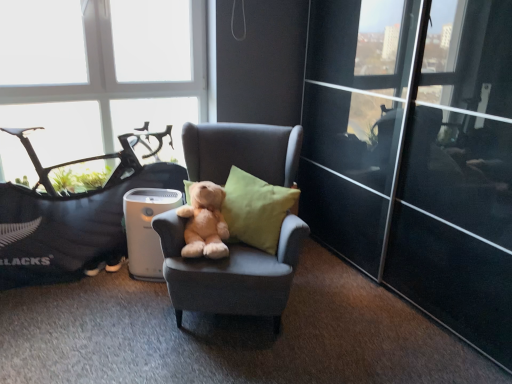
Question: Based on their positions, is matte gray armchair at center located to the left or right of transparent glass door at right?

Choices:
 (A) left
 (B) right

Answer: (A)

Question: Considering the positions of matte gray armchair at center and transparent glass door at right in the image, is matte gray armchair at center wider or thinner than transparent glass door at right?

Choices:
 (A) thin
 (B) wide

Answer: (B)

Question: Which object is the farthest from the transparent glass door at right?

Choices:
 (A) transparent glass window at upper left
 (B) soft plush teddy bear at center
 (C) linen green pillow at center
 (D) matte gray armchair at center
 (E) soft gray bean bag chair at left

Answer: (E)

Question: Which object is positioned closest to the soft plush teddy bear at center?

Choices:
 (A) transparent glass door at right
 (B) linen green pillow at center
 (C) soft gray bean bag chair at left
 (D) matte gray armchair at center
 (E) transparent glass window at upper left

Answer: (D)